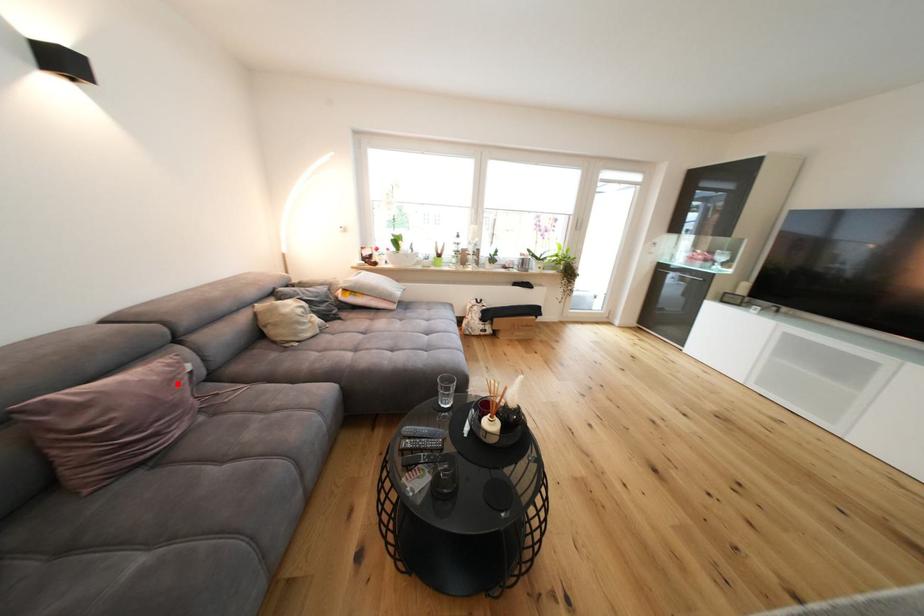
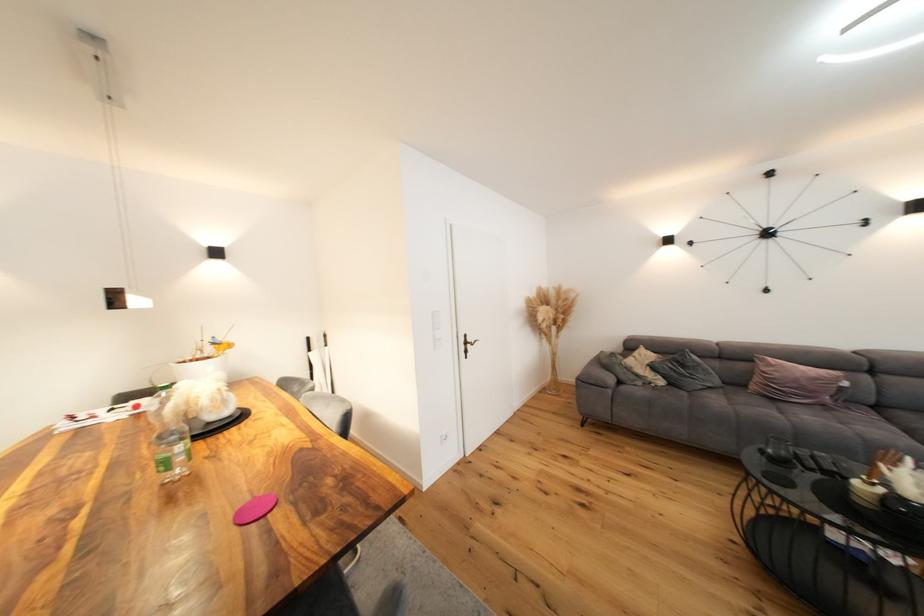
Where in the second image is the point corresponding to the highlighted location from the first image?

(822, 381)